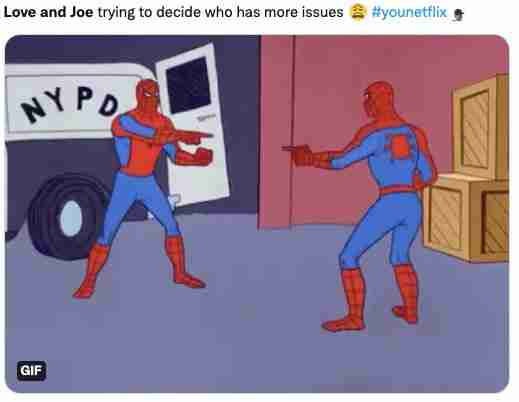
Locate an element on the screen. The width and height of the screenshot is (519, 402). wooden crate is located at coordinates (472, 226), (476, 116).